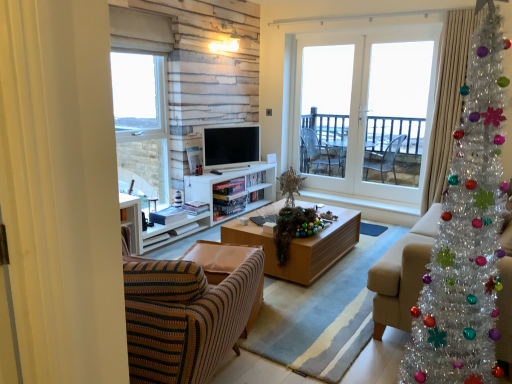
Question: Does matte white television at center have a greater width compared to white glass screen door at center, which is the first screen door in right-to-left order?

Choices:
 (A) no
 (B) yes

Answer: (B)

Question: Considering the relative sizes of matte white television at center and white glass screen door at center, which is the first screen door in right-to-left order, in the image provided, is matte white television at center bigger than white glass screen door at center, which is the first screen door in right-to-left order,?

Choices:
 (A) yes
 (B) no

Answer: (B)

Question: Is matte white television at center positioned before white glass screen door at center, which is the first screen door in right-to-left order?

Choices:
 (A) yes
 (B) no

Answer: (B)

Question: Is matte white television at center aimed at white glass screen door at center, which is the first screen door in right-to-left order?

Choices:
 (A) no
 (B) yes

Answer: (A)

Question: Is matte white television at center positioned beyond the bounds of white glass screen door at center, arranged as the 2th screen door when viewed from the left?

Choices:
 (A) yes
 (B) no

Answer: (A)

Question: Would you consider matte white television at center to be distant from white glass screen door at center, arranged as the 2th screen door when viewed from the left?

Choices:
 (A) yes
 (B) no

Answer: (A)

Question: Does beige fabric couch at right have a lesser width compared to wooden coffee table at center?

Choices:
 (A) yes
 (B) no

Answer: (B)

Question: Is beige fabric couch at right looking in the opposite direction of wooden coffee table at center?

Choices:
 (A) no
 (B) yes

Answer: (A)

Question: Does beige fabric couch at right have a smaller size compared to wooden coffee table at center?

Choices:
 (A) yes
 (B) no

Answer: (B)

Question: Would you say beige fabric couch at right contains wooden coffee table at center?

Choices:
 (A) no
 (B) yes

Answer: (A)

Question: Does beige fabric couch at right have a greater width compared to wooden coffee table at center?

Choices:
 (A) no
 (B) yes

Answer: (B)

Question: From the image's perspective, is beige fabric couch at right under wooden coffee table at center?

Choices:
 (A) no
 (B) yes

Answer: (A)

Question: Is white glass screen door at center, arranged as the 2th screen door when viewed from the left, smaller than shiny tinsel garland at center?

Choices:
 (A) no
 (B) yes

Answer: (A)